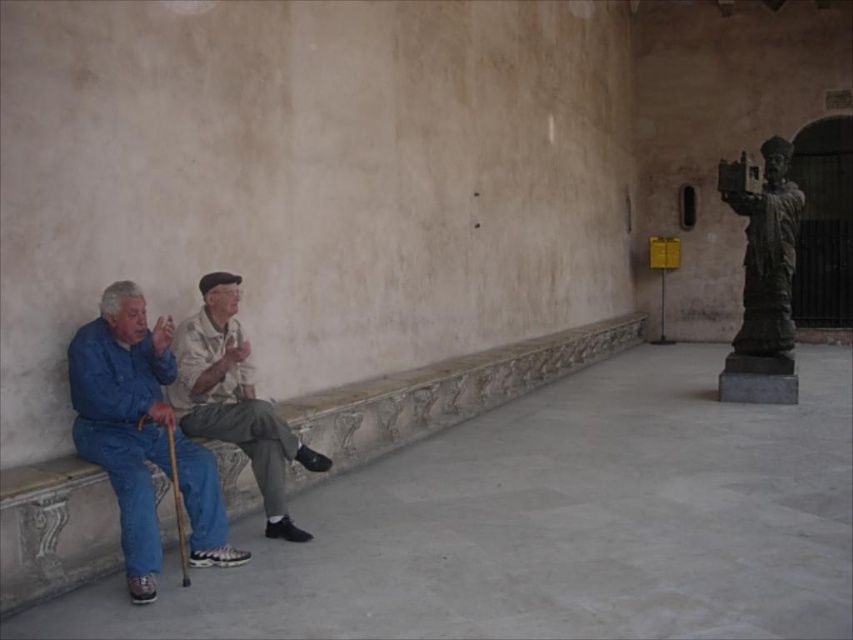
Can you confirm if blue denim jeans at left is taller than bronze statue at right?

No, blue denim jeans at left is not taller than bronze statue at right.

Who is shorter, blue denim jeans at left or bronze statue at right?

With less height is blue denim jeans at left.

The height and width of the screenshot is (640, 853). What are the coordinates of `blue denim jeans at left` in the screenshot? It's located at (141, 435).

Locate an element on the screen. blue denim jeans at left is located at coordinates (141, 435).

Looking at this image, between blue denim jeans at left and khaki fabric pants at center, which one appears on the right side from the viewer's perspective?

Positioned to the right is khaki fabric pants at center.

What do you see at coordinates (141, 435) in the screenshot? I see `blue denim jeans at left` at bounding box center [141, 435].

Find the location of `blue denim jeans at left`. blue denim jeans at left is located at coordinates (141, 435).

Between khaki fabric pants at center and bronze statue at right, which one appears on the right side from the viewer's perspective?

Positioned to the right is bronze statue at right.

Which is behind, point (264, 416) or point (746, 241)?

The point (746, 241) is more distant.

Find the location of a particular element. khaki fabric pants at center is located at coordinates (235, 401).